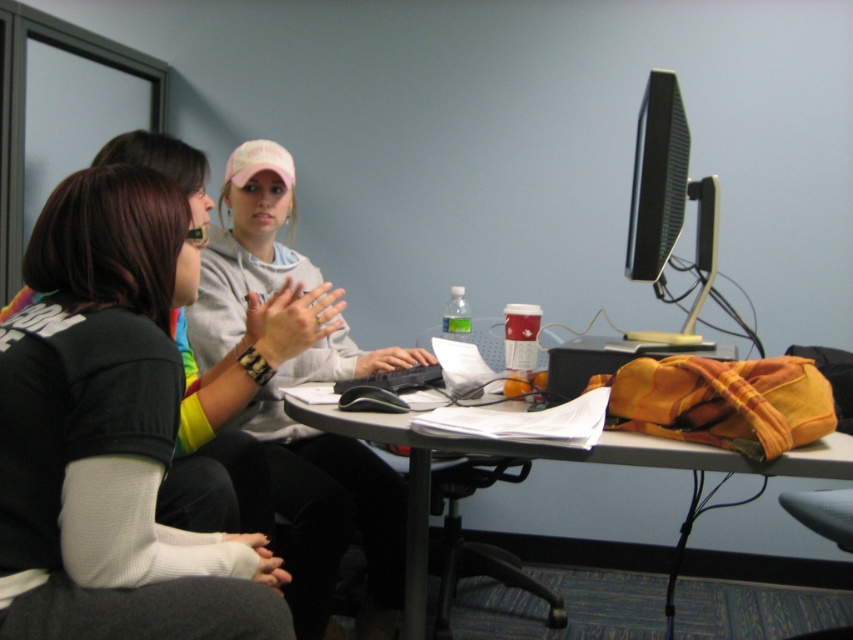
Question: Which object appears closest to the camera in this image?

Choices:
 (A) orange fabric bag at center
 (B) black fabric shirt at left
 (C) gray sweatshirt at center

Answer: (B)

Question: Can you confirm if black fabric shirt at left is bigger than gray sweatshirt at center?

Choices:
 (A) no
 (B) yes

Answer: (A)

Question: Does black fabric shirt at left appear on the right side of orange fabric bag at center?

Choices:
 (A) yes
 (B) no

Answer: (B)

Question: Which point is closer to the camera?

Choices:
 (A) gray sweatshirt at center
 (B) black glossy monitor at upper right
 (C) black fabric shirt at left

Answer: (C)

Question: Can you confirm if black fabric shirt at left is smaller than black glossy monitor at upper right?

Choices:
 (A) yes
 (B) no

Answer: (B)

Question: Which of these objects is positioned farthest from the black fabric shirt at left?

Choices:
 (A) orange fabric bag at center
 (B) black glossy monitor at upper right

Answer: (B)